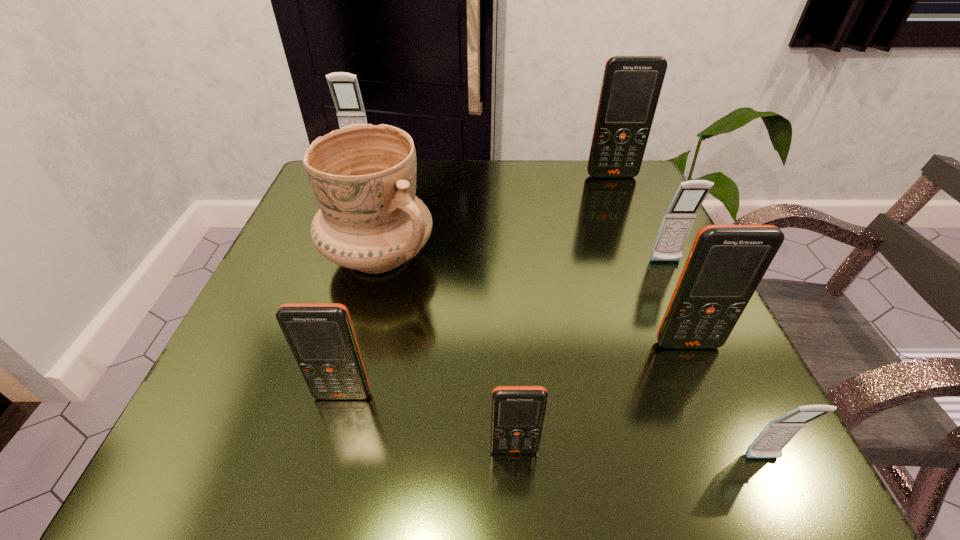
Where is `the third farthest orange cellular telephone`? the third farthest orange cellular telephone is located at coordinates (321, 337).

Find the location of a particular element. This screenshot has height=540, width=960. the fourth object from left to right is located at coordinates (517, 415).

At what (x,y) coordinates should I click in order to perform the action: click on the nearest orange cellular telephone. Please return your answer as a coordinate pair (x, y). The height and width of the screenshot is (540, 960). Looking at the image, I should click on (517, 415).

In order to click on the smallest gray cellular telephone in this screenshot , I will do `click(777, 433)`.

In order to click on free space located on the screen of the biggest orange cellular telephone in this screenshot , I will do point(627,211).

The image size is (960, 540). I want to click on vacant position located 0.070m on the front-facing side of the farthest object, so click(353, 183).

At what (x,y) coordinates should I click in order to perform the action: click on vacant space located on the screen of the second biggest orange cellular telephone. Please return your answer as a coordinate pair (x, y). Looking at the image, I should click on (719, 417).

The width and height of the screenshot is (960, 540). What are the coordinates of `free region located on the left of the beige pottery` in the screenshot? It's located at (279, 256).

Identify the location of vacant space located 0.320m on the front-facing side of the second biggest gray cellular telephone. Image resolution: width=960 pixels, height=540 pixels. (743, 427).

At what (x,y) coordinates should I click in order to perform the action: click on vacant space situated on the screen of the leftmost orange cellular telephone. Please return your answer as a coordinate pair (x, y). Looking at the image, I should click on (328, 450).